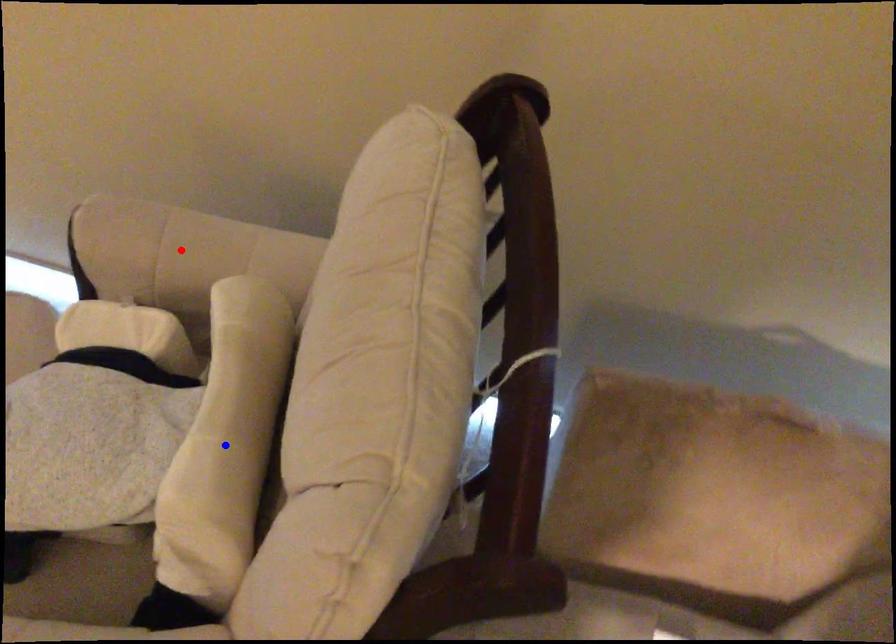
Question: In the image, two points are highlighted. Which point is nearer to the camera? Reply with the corresponding letter.

Choices:
 (A) blue point
 (B) red point

Answer: (A)